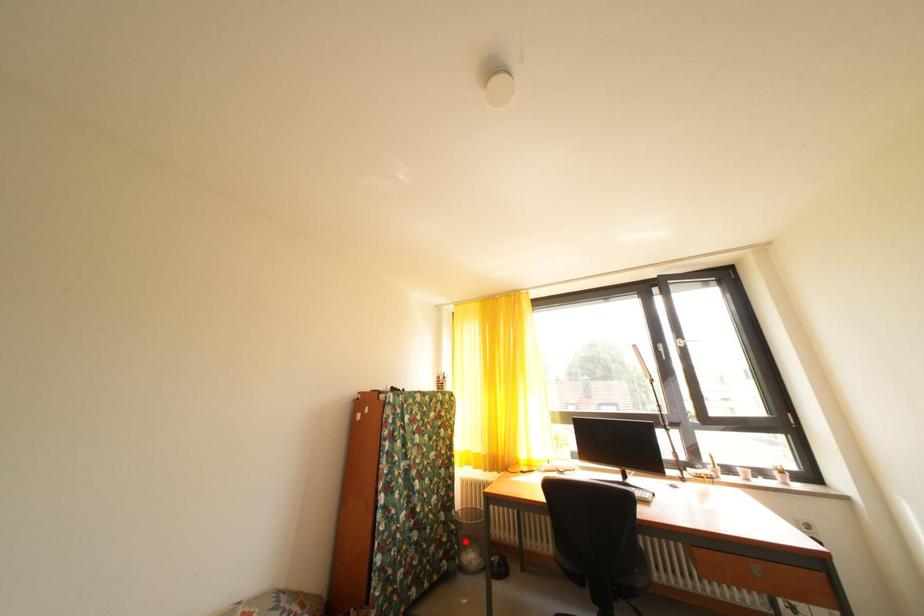
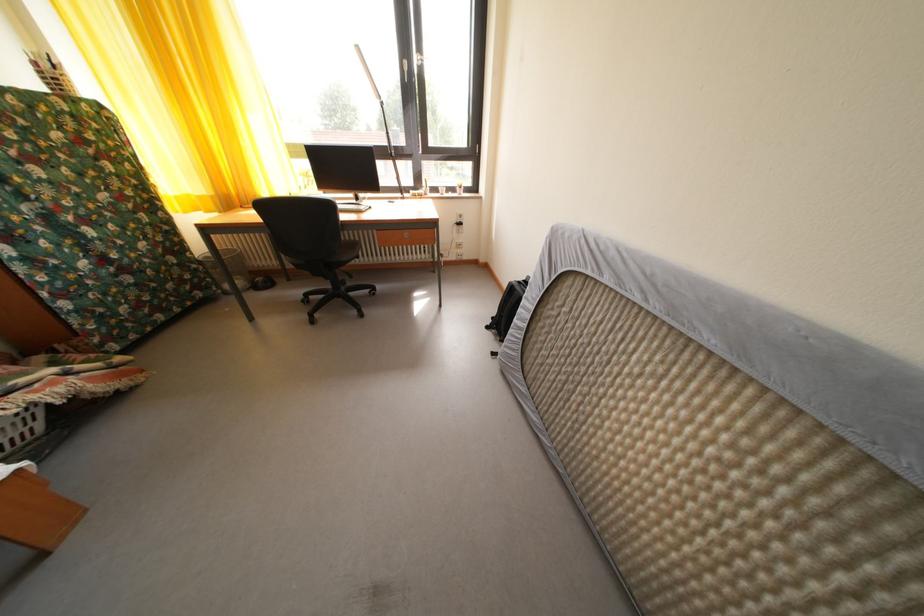
Question: I am providing you with two images of the same scene from different viewpoints. Given a red point in image1, look at the same physical point in image2. Is it:

Choices:
 (A) Closer to the viewpoint
 (B) Farther from the viewpoint

Answer: (A)